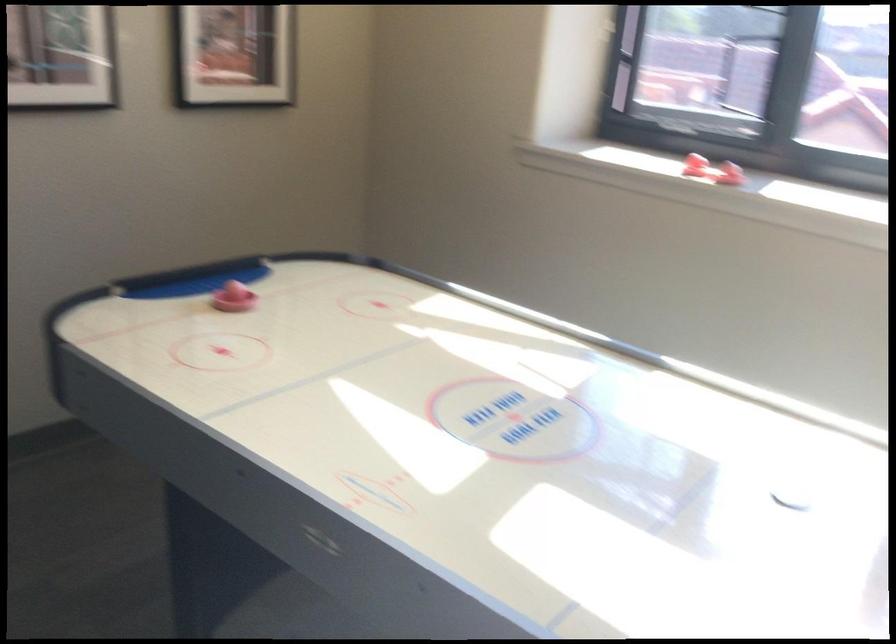
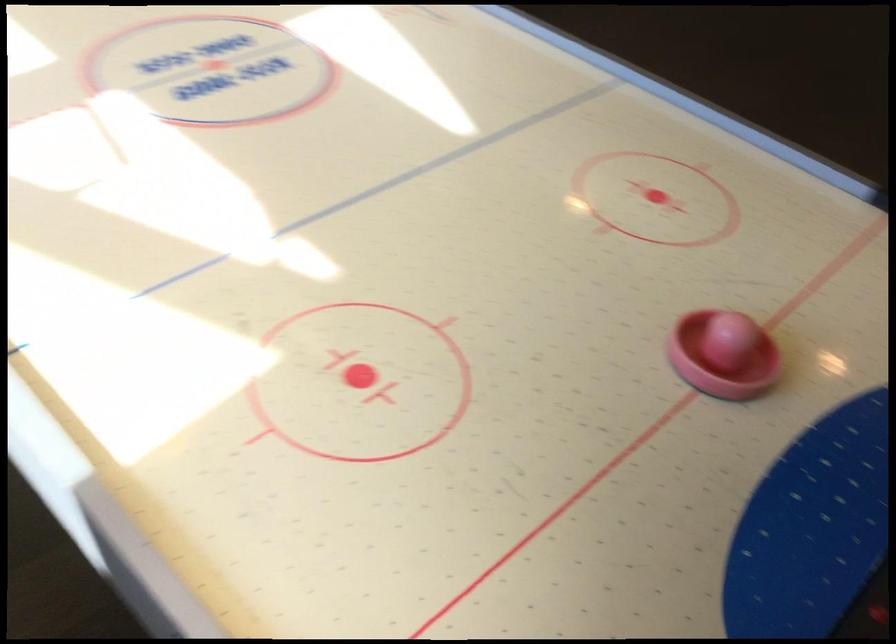
In the second image, find the point that corresponds to (x=209, y=289) in the first image.

(722, 355)